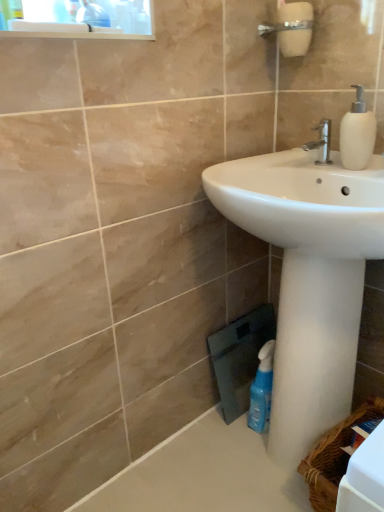
Identify the location of silver metallic faucet at upper center. (321, 142).

Locate an element on the screen. The height and width of the screenshot is (512, 384). silver metallic faucet at upper center is located at coordinates (321, 142).

Between white matte soap dispenser at upper right and silver metallic faucet at upper center, which one appears on the left side from the viewer's perspective?

From the viewer's perspective, silver metallic faucet at upper center appears more on the left side.

Does white matte soap dispenser at upper right have a greater height compared to silver metallic faucet at upper center?

Correct, white matte soap dispenser at upper right is much taller as silver metallic faucet at upper center.

Between white matte soap dispenser at upper right and silver metallic faucet at upper center, which one has smaller size?

With smaller size is silver metallic faucet at upper center.

Is white matte soap dispenser at upper right positioned with its back to silver metallic faucet at upper center?

white matte soap dispenser at upper right does not have its back to silver metallic faucet at upper center.

Looking at this image, from the image's perspective, which is below, silver metallic faucet at upper center or blue translucent bottle at lower right?

blue translucent bottle at lower right is shown below in the image.

From a real-world perspective, is silver metallic faucet at upper center positioned over blue translucent bottle at lower right based on gravity?

Yes, from a real-world perspective, silver metallic faucet at upper center is on top of blue translucent bottle at lower right.

Which object is further away from the camera taking this photo, silver metallic faucet at upper center or blue translucent bottle at lower right?

blue translucent bottle at lower right is further away from the camera.

Which is farther, (x=324, y=119) or (x=259, y=432)?

Positioned behind is point (x=259, y=432).

Is there a large distance between silver metallic faucet at upper center and white matte soap dispenser at upper right?

That's not correct — silver metallic faucet at upper center is a little close to white matte soap dispenser at upper right.

Between silver metallic faucet at upper center and white matte soap dispenser at upper right, which one has larger width?

With larger width is silver metallic faucet at upper center.

Is silver metallic faucet at upper center not inside white matte soap dispenser at upper right?

Indeed, silver metallic faucet at upper center is completely outside white matte soap dispenser at upper right.

Does point (260, 362) come closer to viewer compared to point (313, 454)?

No, it is not.

Is blue translucent bottle at lower right shorter than woven brown basket at lower right?

In fact, blue translucent bottle at lower right may be taller than woven brown basket at lower right.

Considering the relative positions of blue translucent bottle at lower right and woven brown basket at lower right in the image provided, is blue translucent bottle at lower right to the left or to the right of woven brown basket at lower right?

blue translucent bottle at lower right is positioned on woven brown basket at lower right's left side.

Does blue translucent bottle at lower right come behind woven brown basket at lower right?

Yes.

Is woven brown basket at lower right not inside white matte soap dispenser at upper right?

Yes, woven brown basket at lower right is located beyond the bounds of white matte soap dispenser at upper right.

Which of these two, woven brown basket at lower right or white matte soap dispenser at upper right, stands taller?

woven brown basket at lower right.

Which point is more distant from viewer, (311, 501) or (366, 139)?

A: Positioned behind is point (311, 501).

From a real-world perspective, is woven brown basket at lower right located beneath white matte soap dispenser at upper right?

Yes, from a real-world perspective, woven brown basket at lower right is under white matte soap dispenser at upper right.

Would you say woven brown basket at lower right is part of white matte soap dispenser at upper right's contents?

No, woven brown basket at lower right is not inside white matte soap dispenser at upper right.

Is white matte soap dispenser at upper right facing towards woven brown basket at lower right?

No, white matte soap dispenser at upper right is not oriented towards woven brown basket at lower right.

Would you say white matte soap dispenser at upper right is a long distance from woven brown basket at lower right?

They are positioned close to each other.

Is white matte soap dispenser at upper right positioned behind woven brown basket at lower right?

Yes, white matte soap dispenser at upper right is further from the viewer.

From a real-world perspective, which object stands above the other?

From a 3D spatial view, silver metallic faucet at upper center is above.

Between blue translucent bottle at lower right and silver metallic faucet at upper center, which one has smaller width?

silver metallic faucet at upper center.

Is blue translucent bottle at lower right facing towards silver metallic faucet at upper center?

No, blue translucent bottle at lower right is not facing towards silver metallic faucet at upper center.

In the scene shown: Is blue translucent bottle at lower right far from silver metallic faucet at upper center?

blue translucent bottle at lower right is near silver metallic faucet at upper center, not far away.

Locate an element on the screen. tap below the white matte soap dispenser at upper right (from a real-world perspective) is located at coordinates (321, 142).

The width and height of the screenshot is (384, 512). In order to click on tap above the blue translucent bottle at lower right (from a real-world perspective) in this screenshot , I will do `click(321, 142)`.

Which object lies further to the anchor point white matte soap dispenser at upper right, woven brown basket at lower right or blue translucent bottle at lower right?

Among the two, woven brown basket at lower right is located further to white matte soap dispenser at upper right.

Looking at the image, which one is located further to woven brown basket at lower right, blue translucent bottle at lower right or silver metallic faucet at upper center?

silver metallic faucet at upper center lies further to woven brown basket at lower right than the other object.

From the image, which object appears to be farther from woven brown basket at lower right, silver metallic faucet at upper center or blue translucent bottle at lower right?

The object further to woven brown basket at lower right is silver metallic faucet at upper center.

When comparing their distances from white matte soap dispenser at upper right, does woven brown basket at lower right or silver metallic faucet at upper center seem further?

Among the two, woven brown basket at lower right is located further to white matte soap dispenser at upper right.

Looking at the image, which one is located closer to blue translucent bottle at lower right, silver metallic faucet at upper center or white matte soap dispenser at upper right?

silver metallic faucet at upper center.

From the image, which object appears to be farther from blue translucent bottle at lower right, woven brown basket at lower right or silver metallic faucet at upper center?

The object further to blue translucent bottle at lower right is silver metallic faucet at upper center.

Based on their spatial positions, is woven brown basket at lower right or white matte soap dispenser at upper right further from blue translucent bottle at lower right?

white matte soap dispenser at upper right lies further to blue translucent bottle at lower right than the other object.

Estimate the real-world distances between objects in this image. Which object is closer to woven brown basket at lower right, white matte soap dispenser at upper right or blue translucent bottle at lower right?

blue translucent bottle at lower right lies closer to woven brown basket at lower right than the other object.

Where is `tap between white matte soap dispenser at upper right and woven brown basket at lower right vertically`? tap between white matte soap dispenser at upper right and woven brown basket at lower right vertically is located at coordinates tap(321, 142).

Where is `cleaning product between silver metallic faucet at upper center and woven brown basket at lower right in the up-down direction`? cleaning product between silver metallic faucet at upper center and woven brown basket at lower right in the up-down direction is located at coordinates (262, 390).

Find the location of `tap that lies between white matte soap dispenser at upper right and blue translucent bottle at lower right from top to bottom`. tap that lies between white matte soap dispenser at upper right and blue translucent bottle at lower right from top to bottom is located at coordinates (321, 142).

This screenshot has width=384, height=512. Identify the location of cleaning product between white matte soap dispenser at upper right and woven brown basket at lower right in the up-down direction. (262, 390).